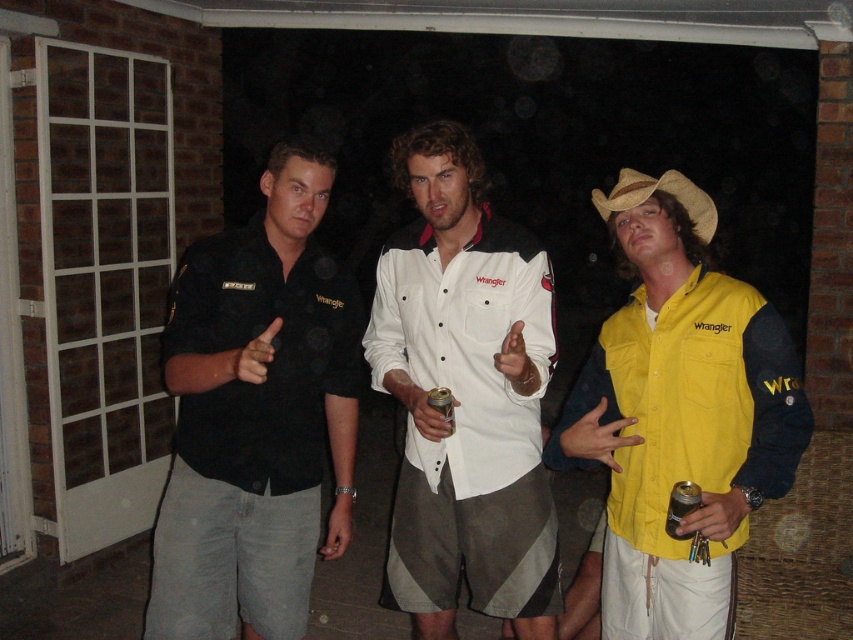
Question: Estimate the real-world distances between objects in this image. Which object is closer to the white cotton shirt at center?

Choices:
 (A) metallic gold can at center
 (B) strawhat at center
 (C) yellow fabric shirt at right
 (D) black matte shirt at left

Answer: (D)

Question: Considering the relative positions of black matte shirt at left and metallic gold can at center in the image provided, where is black matte shirt at left located with respect to metallic gold can at center?

Choices:
 (A) above
 (B) below

Answer: (A)

Question: Does white cotton shirt at center appear on the left side of metallic gold can at center?

Choices:
 (A) no
 (B) yes

Answer: (B)

Question: Estimate the real-world distances between objects in this image. Which object is closer to the metallic gold can at center?

Choices:
 (A) black matte shirt at left
 (B) white cotton shirt at center
 (C) strawhat at center

Answer: (B)

Question: Among these objects, which one is farthest from the camera?

Choices:
 (A) white cotton shirt at center
 (B) metallic gold can at center
 (C) strawhat at center

Answer: (C)

Question: Does yellow fabric shirt at right appear on the right side of strawhat at center?

Choices:
 (A) yes
 (B) no

Answer: (A)